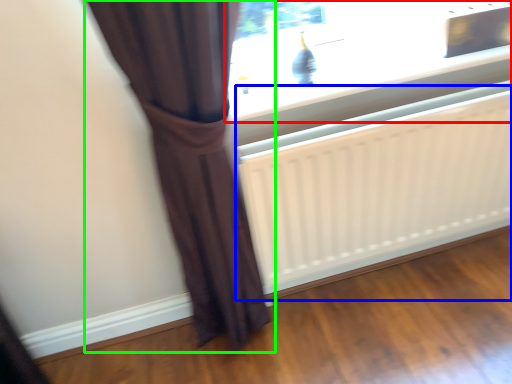
Question: Which is farther away from window (highlighted by a red box)? radiator (highlighted by a blue box) or curtain (highlighted by a green box)?

Choices:
 (A) radiator
 (B) curtain

Answer: (B)